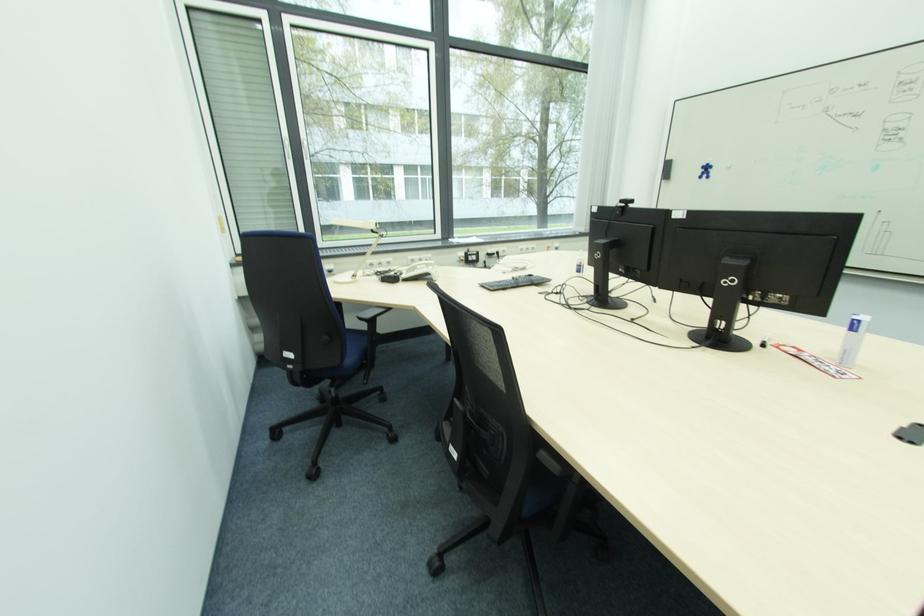
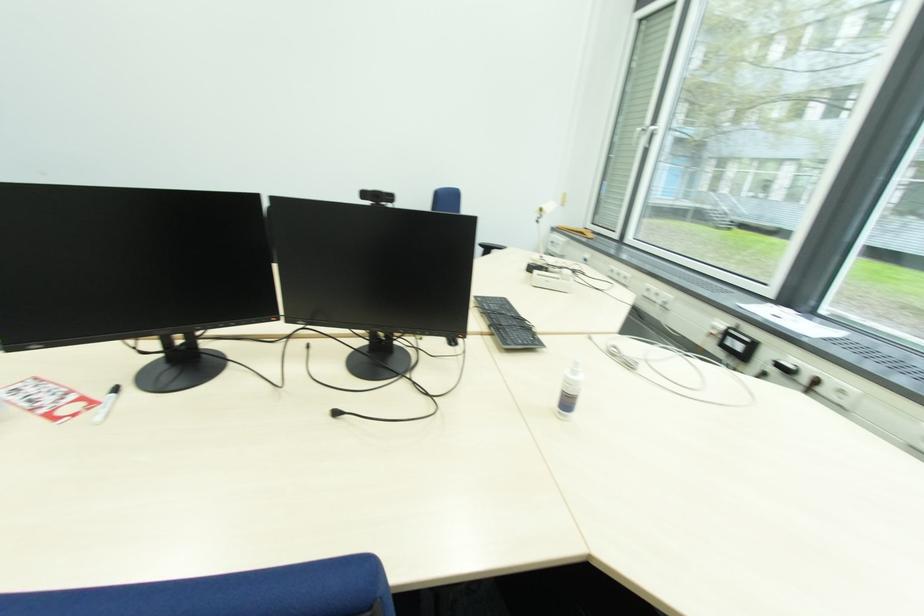
Find the pixel in the second image that matches (769,347) in the first image.

(118, 392)